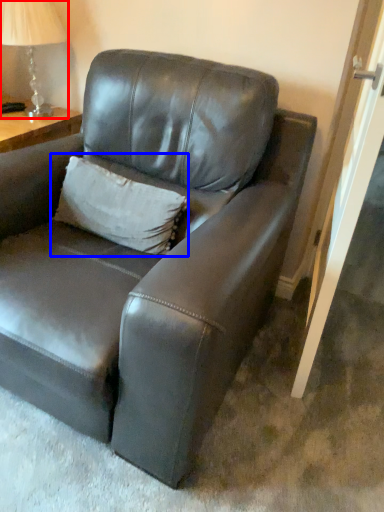
Question: Which point is closer to the camera, table lamp (highlighted by a red box) or pillow (highlighted by a blue box)?

Choices:
 (A) table lamp
 (B) pillow

Answer: (B)